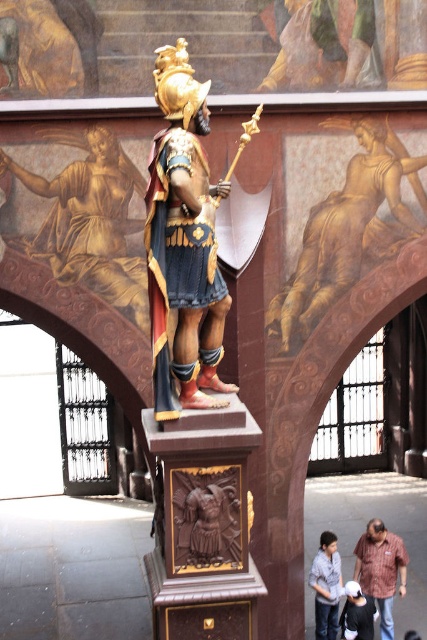
Question: Is the position of gold textured armor at upper center more distant than that of gold metallic statue at upper left?

Choices:
 (A) yes
 (B) no

Answer: (A)

Question: Is gold textured armor at upper center positioned before brown striped shirt at lower right?

Choices:
 (A) yes
 (B) no

Answer: (A)

Question: Estimate the real-world distances between objects in this image. Which object is closer to the gold metallic statue at upper left?

Choices:
 (A) gold textured armor at upper center
 (B) denim jacket at lower right
 (C) wooden warrior at center

Answer: (A)

Question: Which point appears farthest from the camera in this image?

Choices:
 (A) (386, 540)
 (B) (321, 264)
 (C) (67, 179)
 (D) (333, 628)

Answer: (A)

Question: Does wooden warrior at center have a greater width compared to gold metallic statue at upper left?

Choices:
 (A) yes
 (B) no

Answer: (B)

Question: Which object is closer to the camera taking this photo?

Choices:
 (A) gold metallic statue at upper left
 (B) brown striped shirt at lower right
 (C) denim jacket at lower right

Answer: (A)